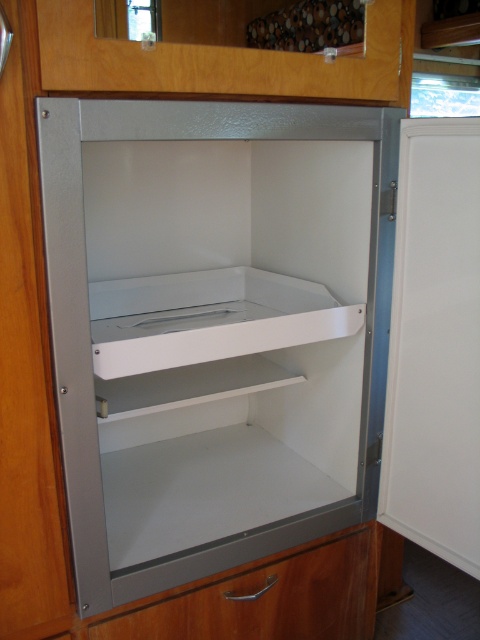
You are organizing items in a small kitchen and need to place a new spice jar that requires a stable surface. The spice jar is 15 cm tall. You have two options for placement inside the cabinet. Which object between the white matte cabinet at center and the matte silver drawer at lower center should you choose based on their positions?

The white matte cabinet at center is positioned on the left side of the matte silver drawer at lower center. Since the spice jar requires a stable surface, the white matte cabinet at center would be more stable as it is part of the main cabinet structure, while the matte silver drawer at lower center might be movable and less stable.

From the picture: You are organizing a kitchen and need to place both the white matte cabinet at center and the matte silver drawer at lower center. Which one requires more space in terms of size?

The white matte cabinet at center requires more space because it is bigger than the matte silver drawer at lower center.

You are standing in a kitchen and want to place a 36 inch long board on the white matte cabinet at center. Can you fit the board on the cabinet?

The white matte cabinet at center is 34.14 inches away from the camera. Since the board is 36 inches long, it is longer than the cabinet depth, so it won not fit.